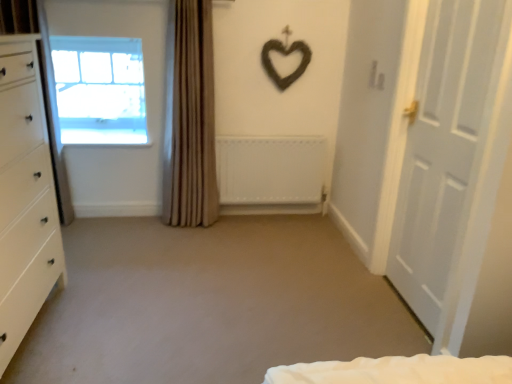
Image resolution: width=512 pixels, height=384 pixels. I want to click on free space in front of white matte door at right, so click(x=389, y=334).